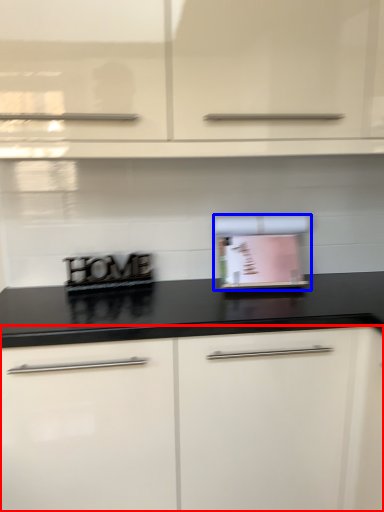
Question: Which object is closer to the camera taking this photo, cabinetry (highlighted by a red box) or appliance (highlighted by a blue box)?

Choices:
 (A) cabinetry
 (B) appliance

Answer: (A)